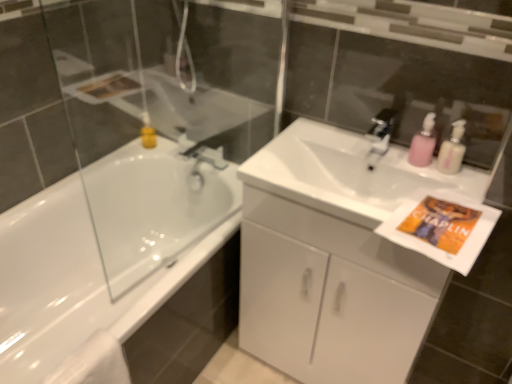
The image size is (512, 384). I want to click on blank space to the left of silver metallic faucet at upper center, so click(x=333, y=140).